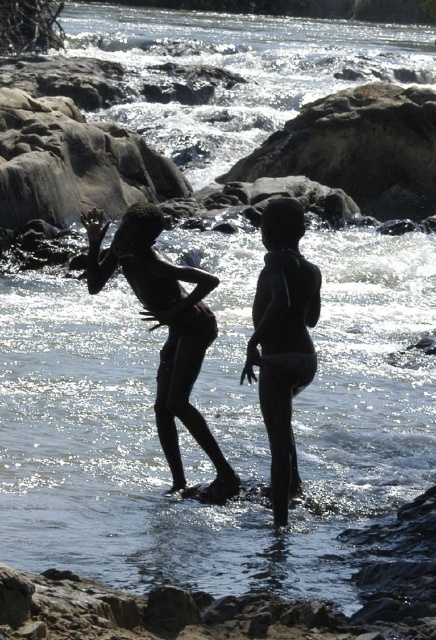
Question: Is black matte skin at center bigger than black matte swimsuit at center?

Choices:
 (A) no
 (B) yes

Answer: (B)

Question: Can you confirm if black matte skin at center is wider than black matte swimsuit at center?

Choices:
 (A) no
 (B) yes

Answer: (B)

Question: Among these points, which one is farthest from the camera?

Choices:
 (A) (156, 285)
 (B) (303, 340)

Answer: (A)

Question: Which object is farther from the camera taking this photo?

Choices:
 (A) black matte swimsuit at center
 (B) black matte skin at center

Answer: (B)

Question: Does black matte skin at center lie behind black matte swimsuit at center?

Choices:
 (A) no
 (B) yes

Answer: (B)